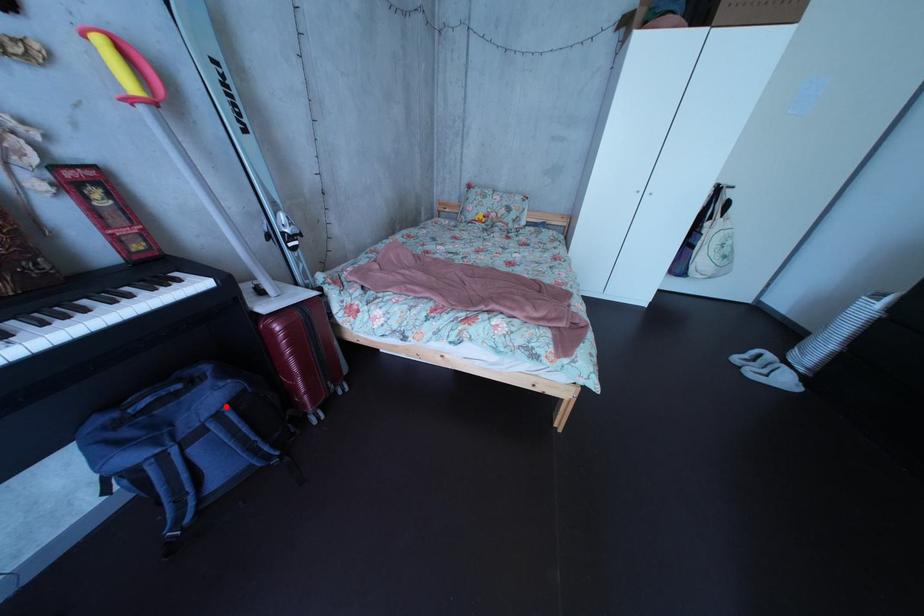
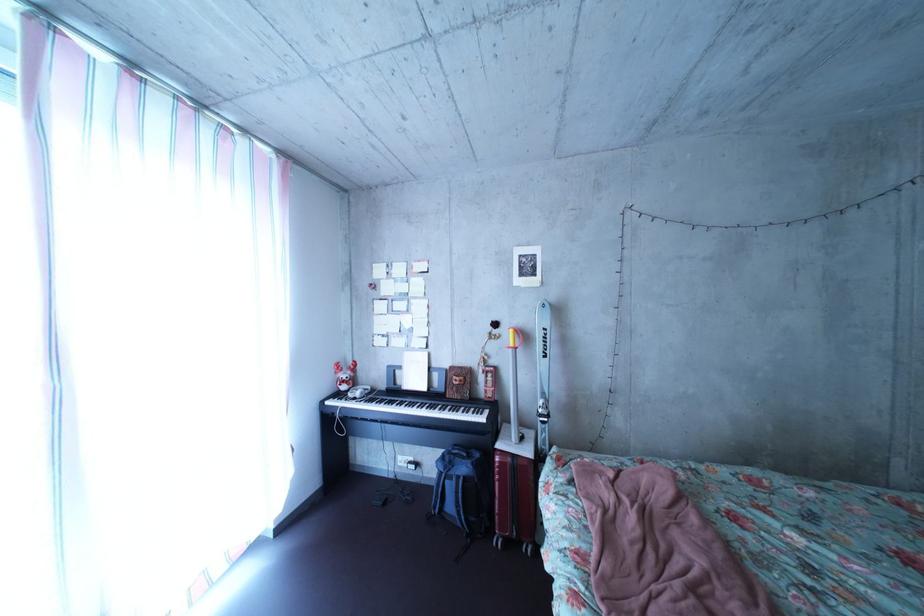
The point at the highlighted location is marked in the first image. Where is the corresponding point in the second image?

(479, 477)